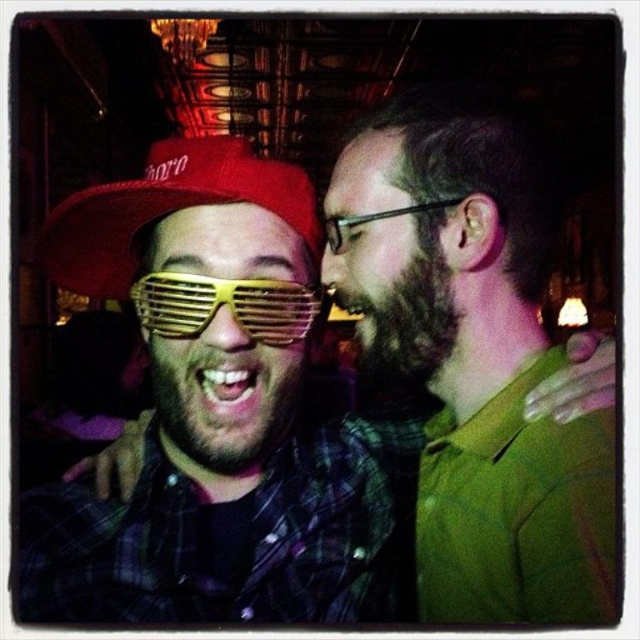
Question: Among these points, which one is nearest to the camera?

Choices:
 (A) (602, 397)
 (B) (307, 180)
 (C) (144, 282)

Answer: (A)

Question: Which object appears closest to the camera in this image?

Choices:
 (A) dark brown fuzzy beard at right
 (B) dark brown fuzzy beard at center

Answer: (B)

Question: Among these points, which one is farthest from the camera?

Choices:
 (A) (483, 326)
 (B) (212, 170)
 (C) (195, 321)
 (D) (371, 323)

Answer: (D)

Question: Where is matte yellow plastic sunglasses at center located in relation to dark brown fuzzy beard at right in the image?

Choices:
 (A) right
 (B) left

Answer: (B)

Question: Is the position of dark brown fuzzy beard at center more distant than that of gold metallic goggles at center?

Choices:
 (A) no
 (B) yes

Answer: (A)

Question: Does matte yellow plastic sunglasses at center have a larger size compared to dark brown fuzzy beard at center?

Choices:
 (A) no
 (B) yes

Answer: (B)